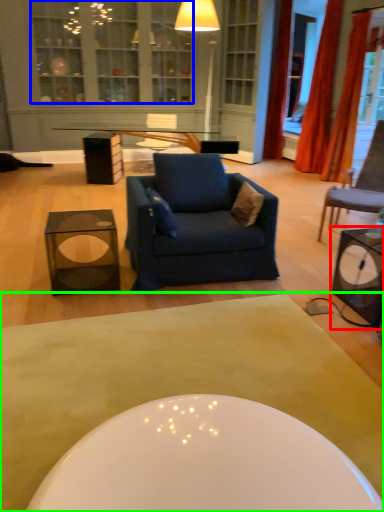
Question: Which object is positioned farthest from table (highlighted by a red box)? Select from cabinetry (highlighted by a blue box) and coffee table (highlighted by a green box).

Choices:
 (A) cabinetry
 (B) coffee table

Answer: (A)